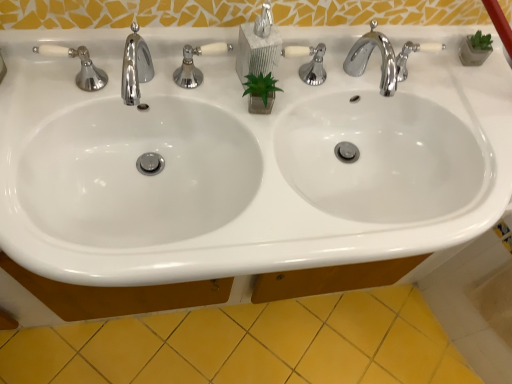
Question: Considering the positions of polished chrome faucet at upper right, acting as the second tap starting from the left, and matte gray soap dispenser at center in the image, is polished chrome faucet at upper right, acting as the second tap starting from the left, taller or shorter than matte gray soap dispenser at center?

Choices:
 (A) short
 (B) tall

Answer: (A)

Question: Based on their positions, is polished chrome faucet at upper right, arranged as the first tap when viewed from the right, located to the left or right of matte gray soap dispenser at center?

Choices:
 (A) right
 (B) left

Answer: (A)

Question: Considering the real-world distances, which object is farthest from the white glossy sink at center?

Choices:
 (A) matte gray soap dispenser at center
 (B) white glossy mirror at upper center
 (C) polished chrome faucet at upper right, arranged as the first tap when viewed from the right
 (D) polished chrome faucet at upper left, which is the 2th tap from right to left
 (E) yellow ceramic tile at lower center

Answer: (E)

Question: Estimate the real-world distances between objects in this image. Which object is farther from the white glossy sink at center?

Choices:
 (A) white glossy mirror at upper center
 (B) yellow ceramic tile at lower center
 (C) polished chrome faucet at upper left, the 1th tap positioned from the left
 (D) polished chrome faucet at upper right, acting as the second tap starting from the left
 (E) matte gray soap dispenser at center

Answer: (B)